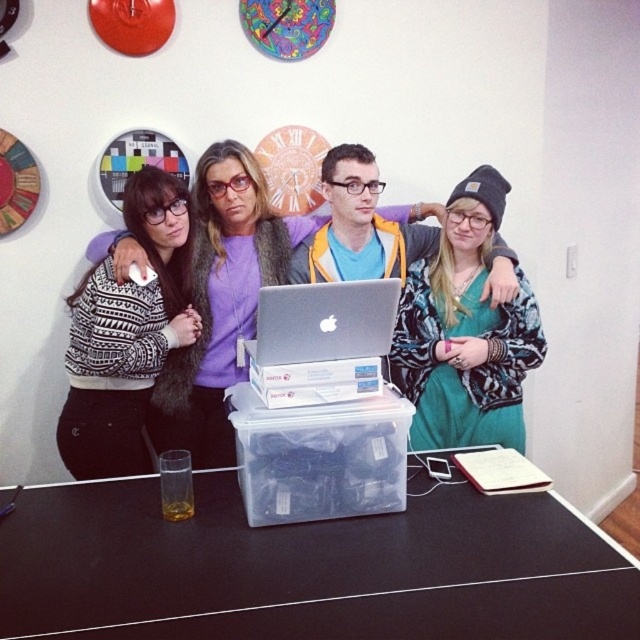
You are standing in the room where the group is posing. You want to take a photo of the scene but need to ensure you are far enough away to capture everything. The camera you are using has a maximum focus range of 6 feet. Is the point at coordinate point (420, 474) within the camera focus range?

The point at coordinate point (420, 474) is 5.96 feet from the camera, which is within the maximum focus range of 6 feet. Therefore, the camera can focus on that point.

You are a photographer adjusting your camera settings to capture the scene. You notice the black knit beanie at upper right and the silver metallic laptop at center. Which object should you focus on first if you want to ensure both are in sharp focus?

The black knit beanie at upper right is further to the viewer than the silver metallic laptop at center. To ensure both are in sharp focus, you should focus on the silver metallic laptop at center first, as it is closer to the background. This way, the depth of field will cover both the foreground and background objects.